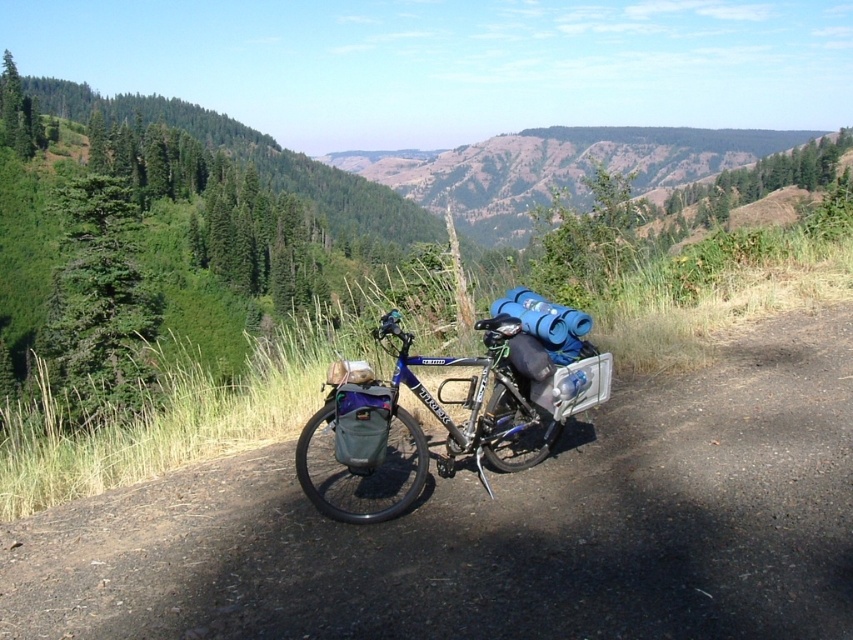
Is dirt track at center positioned behind blue metallic bicycle at center?

No.

Is point (751, 454) positioned behind point (300, 474)?

Yes.

Identify the location of dirt track at center. (498, 529).